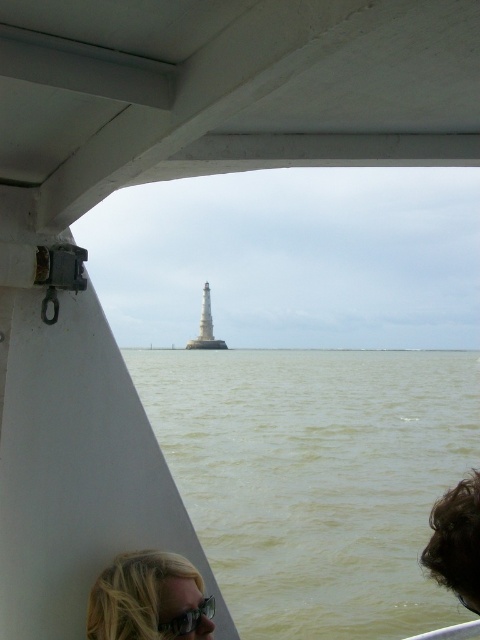
Is blonde hair at lower left behind white stone tower at center?

No, it is in front of white stone tower at center.

Locate an element on the screen. This screenshot has width=480, height=640. blonde hair at lower left is located at coordinates (149, 600).

Can you confirm if blonde hair at lower left is positioned to the left of clear plastic goggles at lower center?

Indeed, blonde hair at lower left is positioned on the left side of clear plastic goggles at lower center.

Who is more forward, [188,625] or [175,632]?

Point [175,632] is more forward.

At what (x,y) coordinates should I click in order to perform the action: click on blonde hair at lower left. Please return your answer as a coordinate pair (x, y). Looking at the image, I should click on (149, 600).

This screenshot has height=640, width=480. Describe the element at coordinates (316, 477) in the screenshot. I see `greenish water at center` at that location.

Between greenish water at center and white stone tower at center, which one appears on the right side from the viewer's perspective?

greenish water at center

Measure the distance between greenish water at center and camera.

greenish water at center is 3.65 meters away from camera.

This screenshot has width=480, height=640. I want to click on greenish water at center, so click(316, 477).